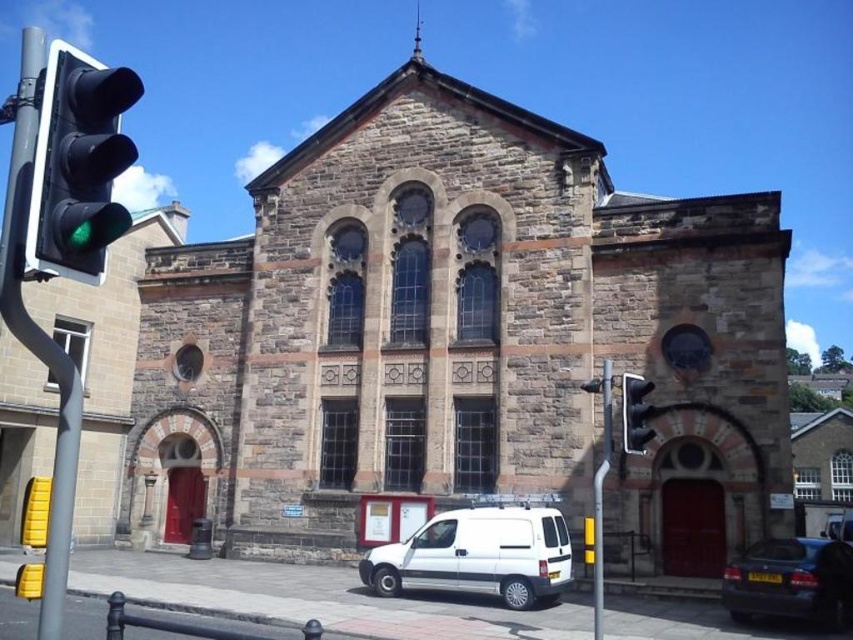
You are a pedestrian standing on the sidewalk in front of the brown stone church at center. You want to cross the street but need to check the traffic light first. Can you see the green glass traffic light at left from your current position? Explain why or why not based on their positions.

Yes, you can see the green glass traffic light at left because the brown stone church at center is above it, meaning the traffic light is positioned lower and likely at street level, making it visible from the sidewalk.

You are a pedestrian standing in front of the stone building and want to cross the street. There is a shiny black car at lower right and a metallic traffic light at right. Which object is closer to the building?

The metallic traffic light at right is closer to the building because the shiny black car at lower right is to the right of it, meaning the car is further away from the building.